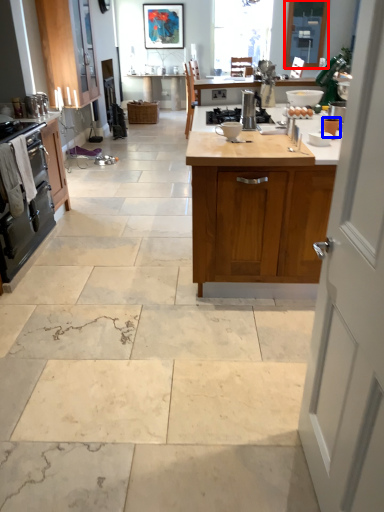
Question: Which object appears closest to the camera in this image, window screen (highlighted by a red box) or appliance (highlighted by a blue box)?

Choices:
 (A) window screen
 (B) appliance

Answer: (B)